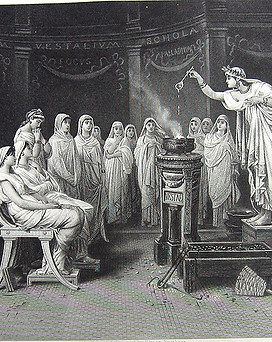
Where is `large serving spoon`? Image resolution: width=272 pixels, height=342 pixels. large serving spoon is located at coordinates (177, 88).